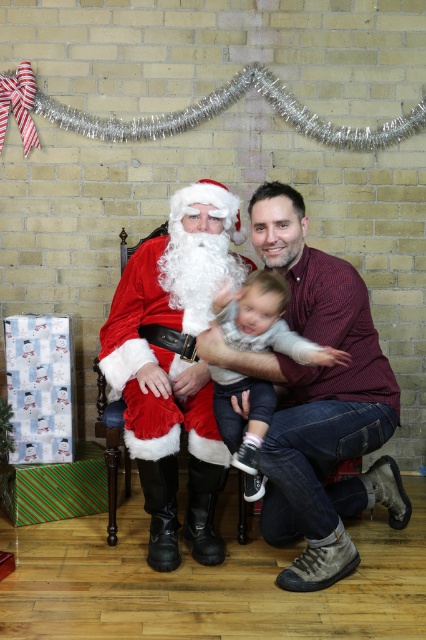
Is point (305, 380) farther from camera compared to point (261, 410)?

That is True.

Between point (245, 369) and point (233, 422), which one is positioned in front?

Point (245, 369) is more forward.

Locate an element on the screen. matte red shirt at center is located at coordinates (319, 401).

Can you confirm if fuzzy red santa at left is positioned below soft gray sweater at center?

No, fuzzy red santa at left is not below soft gray sweater at center.

Does fuzzy red santa at left have a larger size compared to soft gray sweater at center?

Correct, fuzzy red santa at left is larger in size than soft gray sweater at center.

The image size is (426, 640). Find the location of `fuzzy red santa at left`. fuzzy red santa at left is located at coordinates (173, 364).

Who is taller, matte red shirt at center or fuzzy red santa at left?

Standing taller between the two is fuzzy red santa at left.

Can you confirm if matte red shirt at center is smaller than fuzzy red santa at left?

Actually, matte red shirt at center might be larger than fuzzy red santa at left.

Does point (317, 541) come behind point (175, 486)?

That is False.

Find the location of a particular element. The height and width of the screenshot is (640, 426). matte red shirt at center is located at coordinates (319, 401).